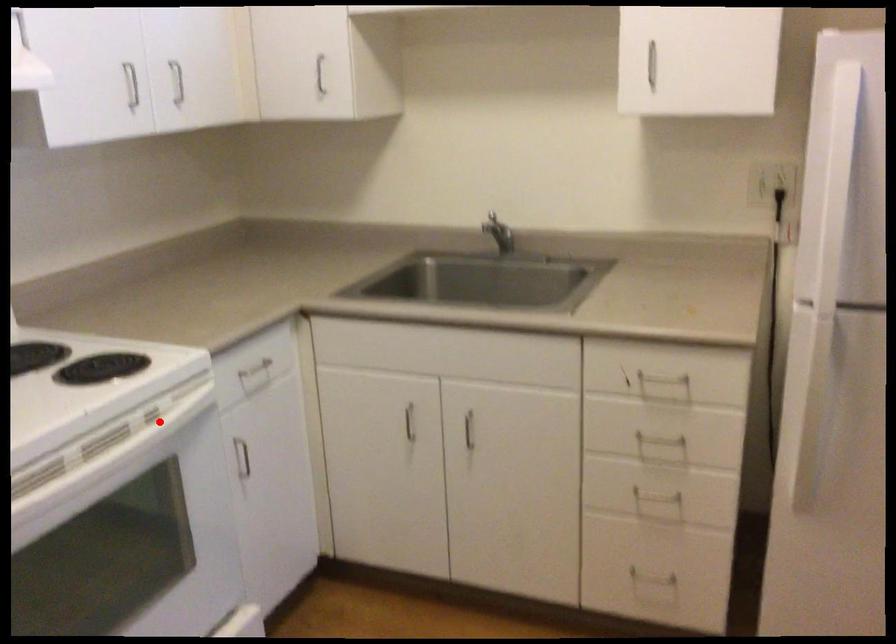
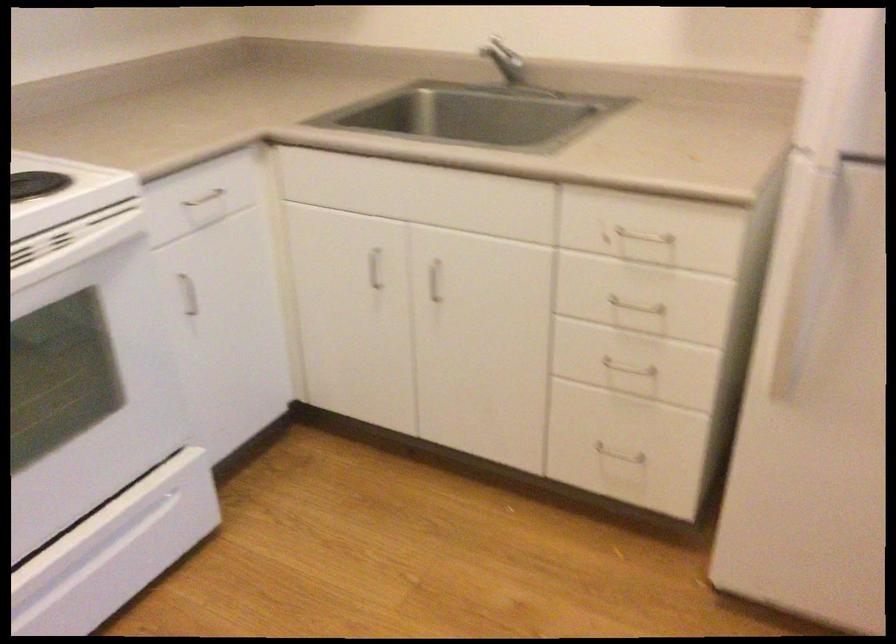
The point at the highlighted location is marked in the first image. Where is the corresponding point in the second image?

(73, 243)